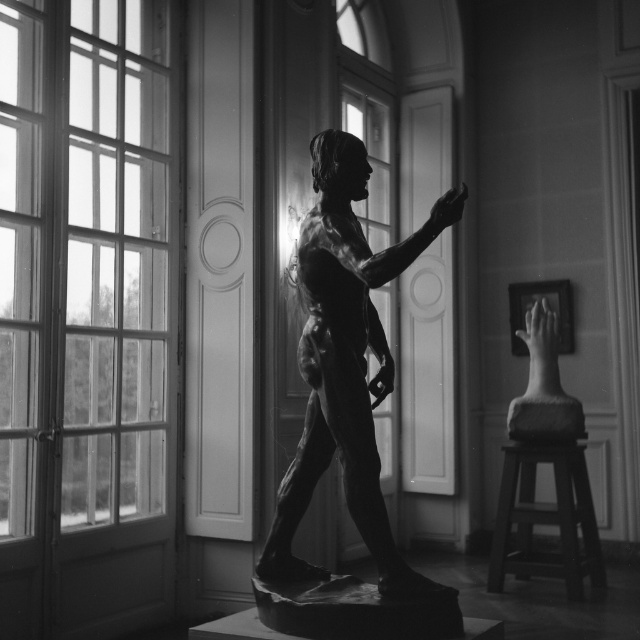
You are standing in the studio and want to check the view outside the clear glass window at left. From your current position, is the window to your left or right side?

The clear glass window at left is located at point (84, 259), which places it to your left side.

You are an art curator planning to move the polished bronze statue at center closer to the clear glass window at left for better lighting. Will the statue be to the right or left of the window after moving?

The polished bronze statue at center will be to the left of the clear glass window at left after moving because the window is already positioned to the left of the statue. Moving the statue closer to the window would place it on the same side as the window, making it now to the left of the window.